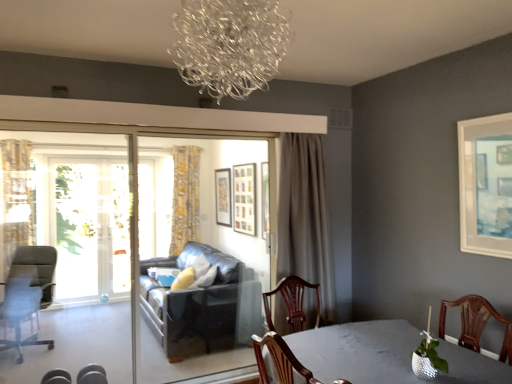
Question: Is transparent glass screen door at left, arranged as the 3th screen door when viewed from the front, thinner than wooden picture frame at center, which is the 3th picture frame from front to back?

Choices:
 (A) yes
 (B) no

Answer: (B)

Question: Would you consider transparent glass screen door at left, which is the 1th screen door in left-to-right order, to be distant from wooden picture frame at center, the 3th picture frame in the right-to-left sequence?

Choices:
 (A) yes
 (B) no

Answer: (A)

Question: Considering the relative sizes of transparent glass screen door at left, arranged as the 3th screen door when viewed from the front, and wooden picture frame at center, which is the 2th picture frame from left to right, in the image provided, is transparent glass screen door at left, arranged as the 3th screen door when viewed from the front, taller than wooden picture frame at center, which is the 2th picture frame from left to right,?

Choices:
 (A) yes
 (B) no

Answer: (A)

Question: Is transparent glass screen door at left, the first screen door in the back-to-front sequence, behind wooden picture frame at center, which is counted as the 2th picture frame, starting from the back?

Choices:
 (A) yes
 (B) no

Answer: (A)

Question: From the image's perspective, does transparent glass screen door at left, the third screen door positioned from the right, appear lower than wooden picture frame at center, the 3th picture frame in the right-to-left sequence?

Choices:
 (A) yes
 (B) no

Answer: (A)

Question: Is transparent glass screen door at left, the first screen door in the back-to-front sequence, shorter than wooden picture frame at center, which is the 2th picture frame from left to right?

Choices:
 (A) no
 (B) yes

Answer: (A)

Question: Is yellow floral fabric curtain at left, which appears as the first curtain when viewed from the left, thinner than white matte picture frame at upper right, which appears as the 4th picture frame when viewed from the left?

Choices:
 (A) no
 (B) yes

Answer: (A)

Question: From the image's perspective, is yellow floral fabric curtain at left, which is counted as the second curtain, starting from the front, beneath white matte picture frame at upper right, which appears as the 4th picture frame when viewed from the left?

Choices:
 (A) yes
 (B) no

Answer: (A)

Question: Is yellow floral fabric curtain at left, which appears as the first curtain when viewed from the left, far from white matte picture frame at upper right, which appears as the 4th picture frame when viewed from the left?

Choices:
 (A) yes
 (B) no

Answer: (A)

Question: Is yellow floral fabric curtain at left, which appears as the first curtain when viewed from the left, not inside white matte picture frame at upper right, marked as the 4th picture frame in a back-to-front arrangement?

Choices:
 (A) no
 (B) yes

Answer: (B)

Question: Could you tell me if yellow floral fabric curtain at left, which appears as the second curtain when viewed from the back, is facing white matte picture frame at upper right, marked as the 4th picture frame in a back-to-front arrangement?

Choices:
 (A) no
 (B) yes

Answer: (A)

Question: From a real-world perspective, is yellow floral fabric curtain at left, which appears as the first curtain when viewed from the left, below white matte picture frame at upper right, the first picture frame in the front-to-back sequence?

Choices:
 (A) no
 (B) yes

Answer: (B)

Question: Can you confirm if yellow floral fabric curtain at center, which ranks as the 2th curtain in right-to-left order, is positioned to the right of white matte picture frame at upper right, marked as the first picture frame in a right-to-left arrangement?

Choices:
 (A) no
 (B) yes

Answer: (A)